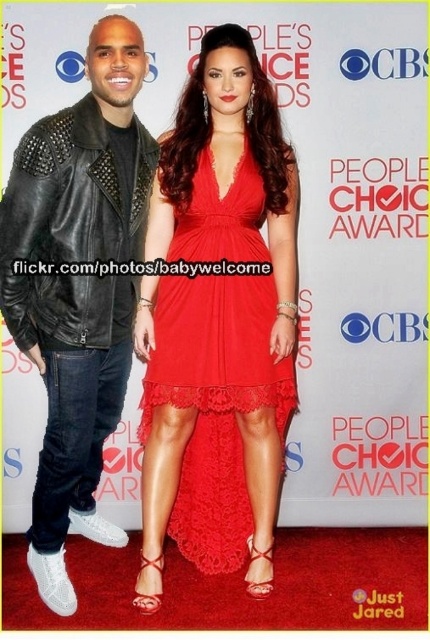
Based on the photo, you are a photographer at the People Choice Awards. You need to capture a closeup shot of the matte red dress at center without including the black leather jacket at left in the frame. Is this possible given their sizes?

The matte red dress at center is smaller than the black leather jacket at left, so it may be possible to frame the shot to exclude the jacket if the camera angle and distance allow focusing on the dress alone.

You are a photographer at the People Choice Awards. You need to capture a photo that includes both the matte red dress at center and the black leather jacket at left. Which object should you ensure is in the foreground to make sure both are visible?

The matte red dress at center is positioned under the black leather jacket at left. To ensure both are visible in the photo, you should position the camera so that the black leather jacket at left is in the foreground, allowing the matte red dress at center to be seen behind it.

In the scene shown: You are a photographer at the People Choice Awards event. You need to capture a photo where the matte red dress at center and the black leather jacket at left are both visible. Based on their positions, which one should you ensure is closer to the right side of the frame?

The matte red dress at center is positioned on the right side of the black leather jacket at left, so to include both in the frame, the matte red dress at center should be closer to the right side of the frame.